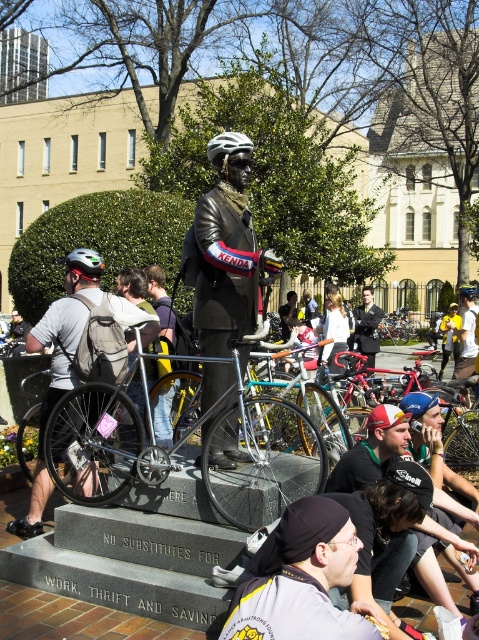
Is shiny silver bicycle at center shorter than bronze statue at center?

Yes, shiny silver bicycle at center is shorter than bronze statue at center.

Which of these two, shiny silver bicycle at center or bronze statue at center, stands shorter?

shiny silver bicycle at center is shorter.

Locate an element on the screen. shiny silver bicycle at center is located at coordinates (262, 456).

Is matte black helmet at upper left wider than blue matte bicycle helmet at center?

No.

Which is above, matte black helmet at upper left or blue matte bicycle helmet at center?

blue matte bicycle helmet at center is above.

Find the location of `matte black helmet at upper left`. matte black helmet at upper left is located at coordinates (83, 262).

The width and height of the screenshot is (479, 640). I want to click on matte black helmet at upper left, so click(83, 262).

This screenshot has width=479, height=640. What do you see at coordinates (374, 449) in the screenshot? I see `red cap at center` at bounding box center [374, 449].

Image resolution: width=479 pixels, height=640 pixels. Find the location of `red cap at center`. red cap at center is located at coordinates (374, 449).